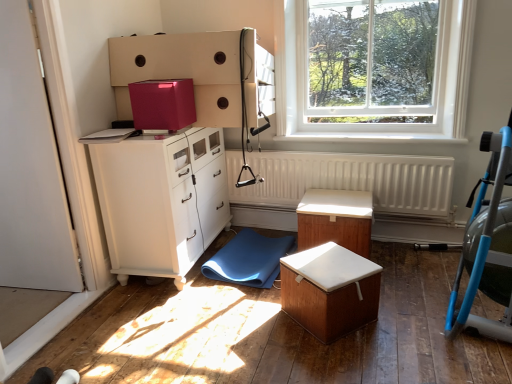
This screenshot has height=384, width=512. I want to click on space that is in front of white glossy cabinet at left, so click(170, 322).